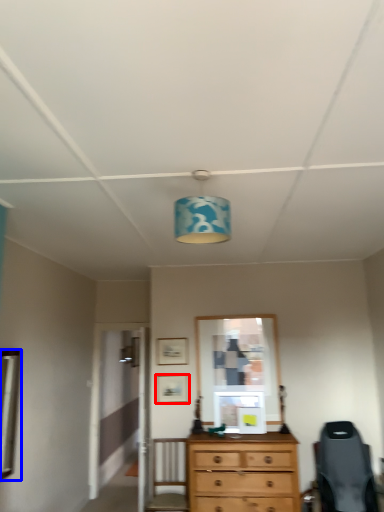
Question: Which point is closer to the camera, picture frame (highlighted by a red box) or mirror (highlighted by a blue box)?

Choices:
 (A) picture frame
 (B) mirror

Answer: (B)